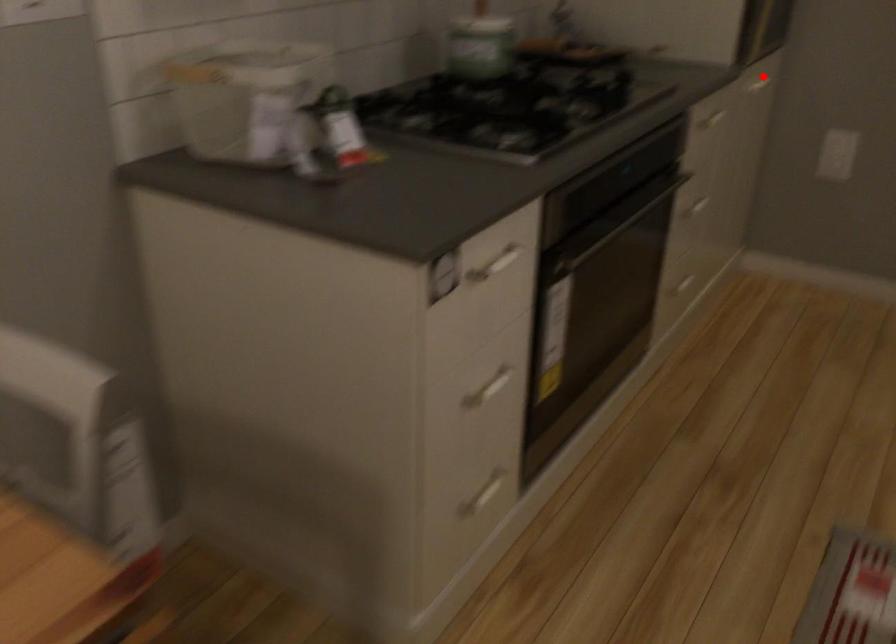
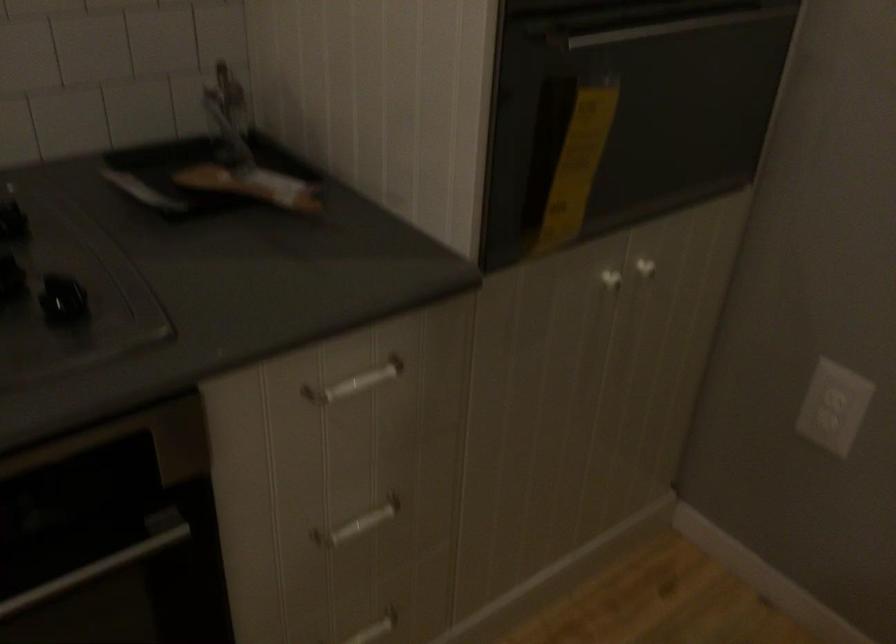
The point at the highlighted location is marked in the first image. Where is the corresponding point in the second image?

(609, 278)